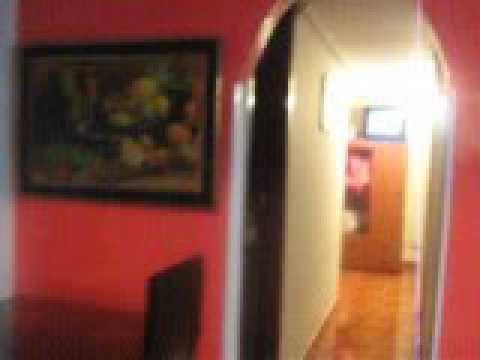
The width and height of the screenshot is (480, 360). I want to click on wood floor, so click(x=352, y=302), click(x=352, y=323), click(x=386, y=297).